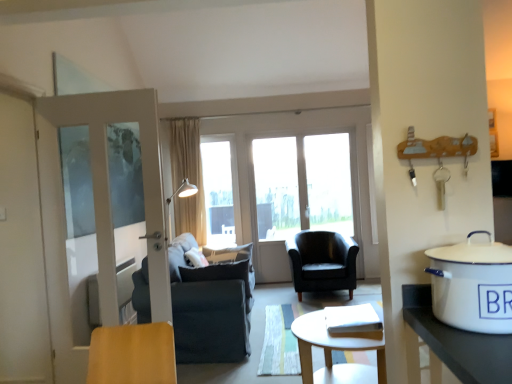
Question: Considering the relative sizes of transparent glass window at center and white glossy screen door at left in the image provided, is transparent glass window at center thinner than white glossy screen door at left?

Choices:
 (A) no
 (B) yes

Answer: (B)

Question: Does transparent glass window at center come behind white glossy screen door at left?

Choices:
 (A) yes
 (B) no

Answer: (A)

Question: Is transparent glass window at center bigger than white glossy screen door at left?

Choices:
 (A) no
 (B) yes

Answer: (A)

Question: Does transparent glass window at center have a greater height compared to white glossy screen door at left?

Choices:
 (A) no
 (B) yes

Answer: (A)

Question: Does transparent glass window at center have a smaller size compared to white glossy screen door at left?

Choices:
 (A) yes
 (B) no

Answer: (A)

Question: Is black leather armchair at center, marked as the 2th chair in a front-to-back arrangement, in front of or behind white enamel pot at right in the image?

Choices:
 (A) behind
 (B) front

Answer: (A)

Question: From a real-world perspective, is black leather armchair at center, marked as the 2th chair in a front-to-back arrangement, physically located above or below white enamel pot at right?

Choices:
 (A) below
 (B) above

Answer: (A)

Question: Does point [312, 231] appear closer or farther from the camera than point [505, 251]?

Choices:
 (A) closer
 (B) farther

Answer: (B)

Question: Looking at their shapes, would you say black leather armchair at center, marked as the 1th chair in a back-to-front arrangement, is wider or thinner than white enamel pot at right?

Choices:
 (A) wide
 (B) thin

Answer: (A)

Question: Is point (192, 170) positioned closer to the camera than point (470, 243)?

Choices:
 (A) closer
 (B) farther

Answer: (B)

Question: Relative to white enamel pot at right, is beige fabric curtain at center in front or behind?

Choices:
 (A) front
 (B) behind

Answer: (B)

Question: From the image's perspective, relative to white enamel pot at right, is beige fabric curtain at center above or below?

Choices:
 (A) above
 (B) below

Answer: (A)

Question: Is beige fabric curtain at center wider or thinner than white enamel pot at right?

Choices:
 (A) wide
 (B) thin

Answer: (A)

Question: Would you say dark gray fabric chair at center, placed as the second chair when sorted from right to left, is inside or outside black leather armchair at center, the second chair in the left-to-right sequence?

Choices:
 (A) inside
 (B) outside

Answer: (B)

Question: From the image's perspective, relative to black leather armchair at center, marked as the 2th chair in a front-to-back arrangement, is dark gray fabric chair at center, the 2th chair viewed from the back, above or below?

Choices:
 (A) above
 (B) below

Answer: (B)